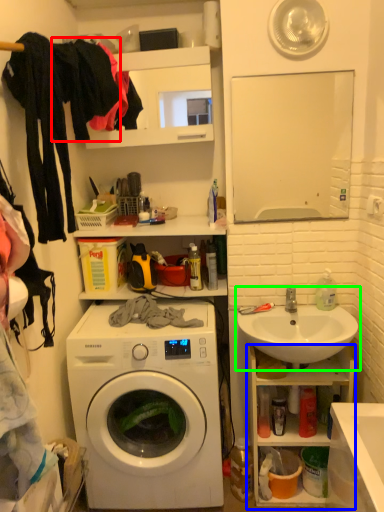
Question: Which object is positioned closest to clothing (highlighted by a red box)? Select from cabinet (highlighted by a blue box) and sink (highlighted by a green box).

Choices:
 (A) cabinet
 (B) sink

Answer: (B)